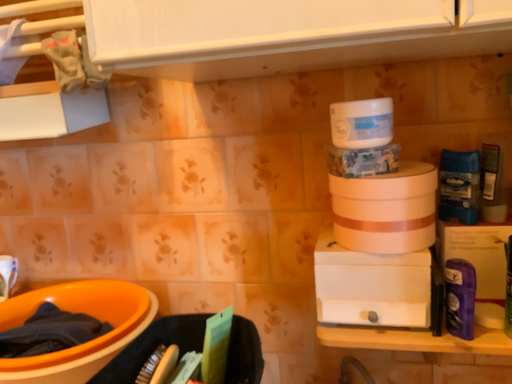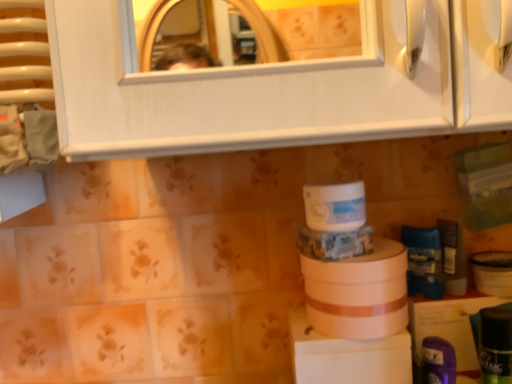
Question: How did the camera likely rotate when shooting the video?

Choices:
 (A) rotated upward
 (B) rotated downward

Answer: (A)